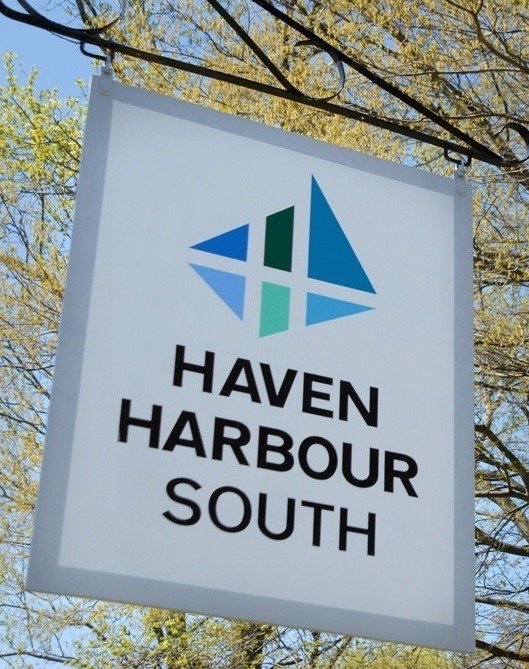
The width and height of the screenshot is (529, 669). Identify the location of hanger. (108, 62).